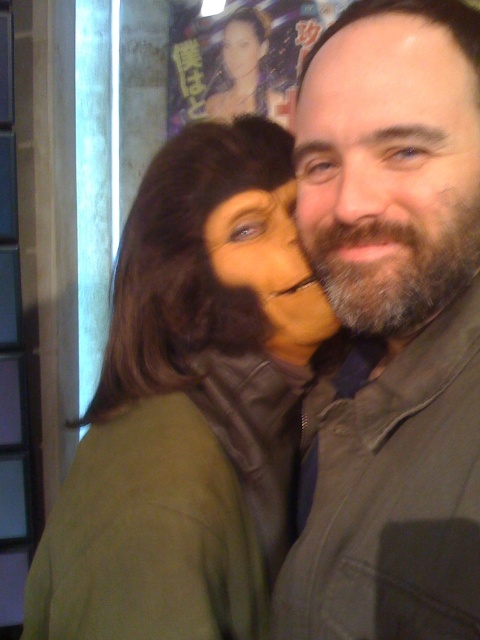
You are taking a photo of two people in a room with a poster in the background. The poster has Japanese text and a figure with long hair. You see the bearded man at center and the matte black hair at center. Which one is positioned lower in the image?

The bearded man at center is positioned lower than the matte black hair at center in the image.

You are taking a photo of two people in a dimly lit room with a poster in the background. You notice the green matte jacket at center and the smooth skin face at center. Which object is taller in the image?

The green matte jacket at center is taller than the smooth skin face at center.